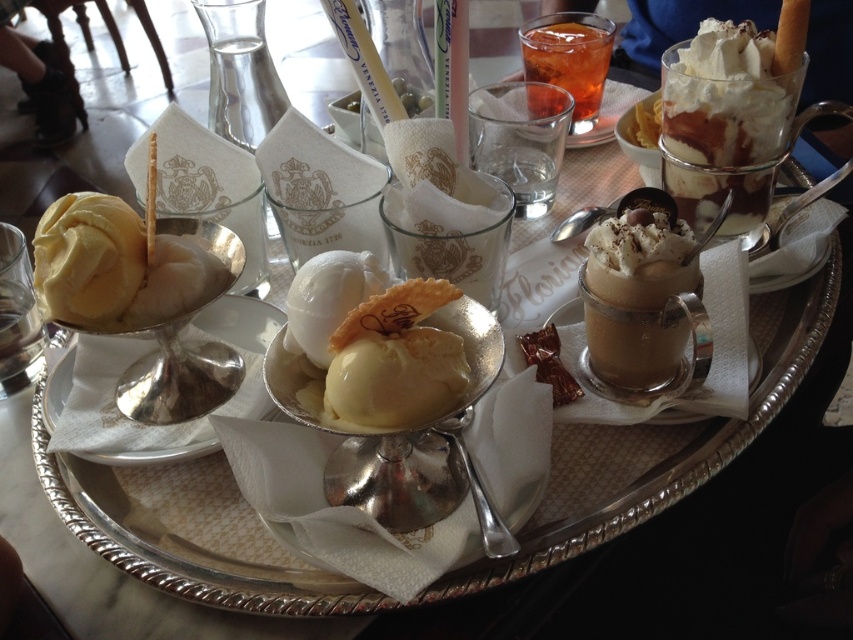
Identify the location of smooth chocolate mousse at center. The height and width of the screenshot is (640, 853). (636, 298).

Which is behind, point (611, 268) or point (531, 24)?

Point (531, 24)

Describe the element at coordinates (636, 298) in the screenshot. I see `smooth chocolate mousse at center` at that location.

The height and width of the screenshot is (640, 853). What are the coordinates of `smooth chocolate mousse at center` in the screenshot? It's located at (636, 298).

This screenshot has width=853, height=640. Find the location of `yellow creamy ice cream at center`. yellow creamy ice cream at center is located at coordinates (376, 340).

You are a GUI agent. You are given a task and a screenshot of the screen. Output one action in this format:
    pyautogui.click(x=<x>, y=<y>)
    Task: Click on the yellow creamy ice cream at center
    
    Given the screenshot: What is the action you would take?
    pyautogui.click(x=376, y=340)

Where is `swirled caramel ice cream sundae at upper right`? swirled caramel ice cream sundae at upper right is located at coordinates (723, 125).

Looking at this image, does swirled caramel ice cream sundae at upper right have a greater width compared to yellow creamy ice cream at center?

Yes, swirled caramel ice cream sundae at upper right is wider than yellow creamy ice cream at center.

Identify the location of swirled caramel ice cream sundae at upper right. (723, 125).

Identify the location of swirled caramel ice cream sundae at upper right. (723, 125).